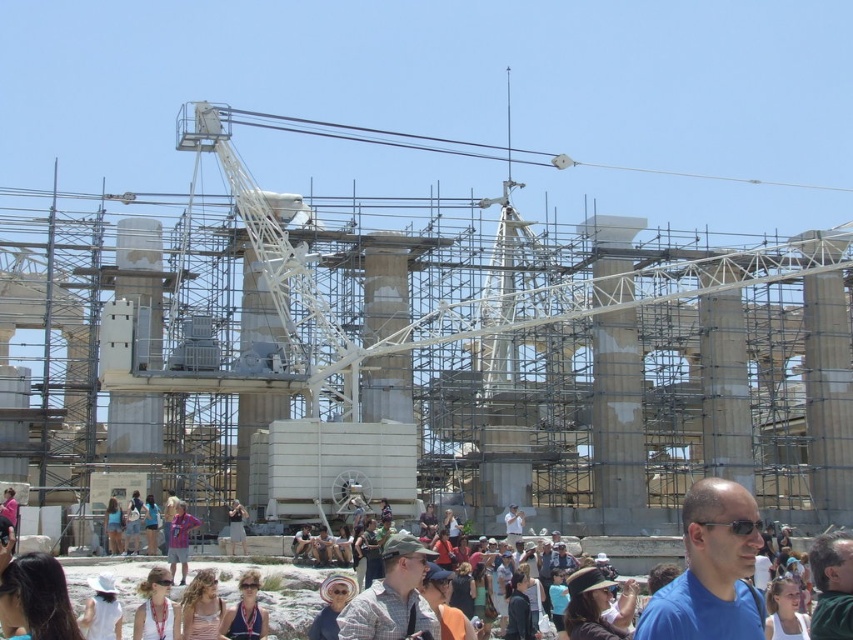
You are a photographer trying to capture a clear shot of the archaeological site. You notice two items in the foreground that might obstruct your view. These items are the white fabric sunglasses at center and the blue denim shorts at center. Which item is taller and could potentially block more of the background?

The blue denim shorts at center are taller than the white fabric sunglasses at center, so they could potentially block more of the background.

You are standing at the archaeological site and want to take a photo of the two points mentioned. Which point, point (154,625) or point (114,515), is closer to you?

Point (154,625) is closer to the viewer than point (114,515) according to the description.